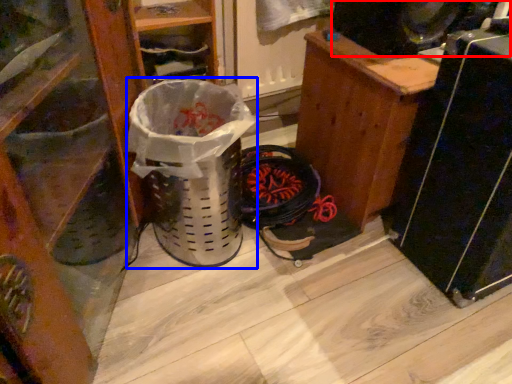
Question: Which object is further to the camera taking this photo, speaker (highlighted by a red box) or garbage (highlighted by a blue box)?

Choices:
 (A) speaker
 (B) garbage

Answer: (A)